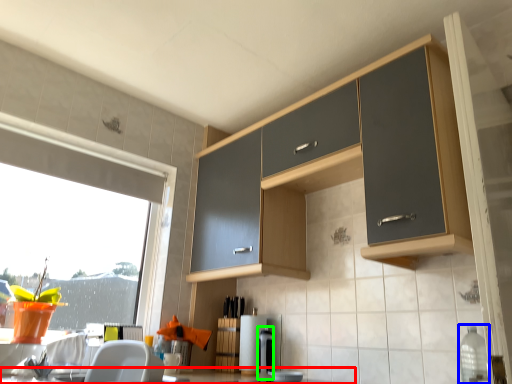
Question: Which object is the farthest from countertop (highlighted by a red box)? Choose among these: bottle (highlighted by a blue box) or appliance (highlighted by a green box).

Choices:
 (A) bottle
 (B) appliance

Answer: (A)